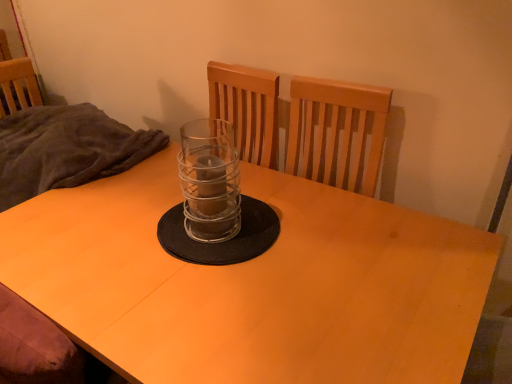
Locate an element on the screen. vacant area situated to the left side of clear glass candle holder at center is located at coordinates (135, 228).